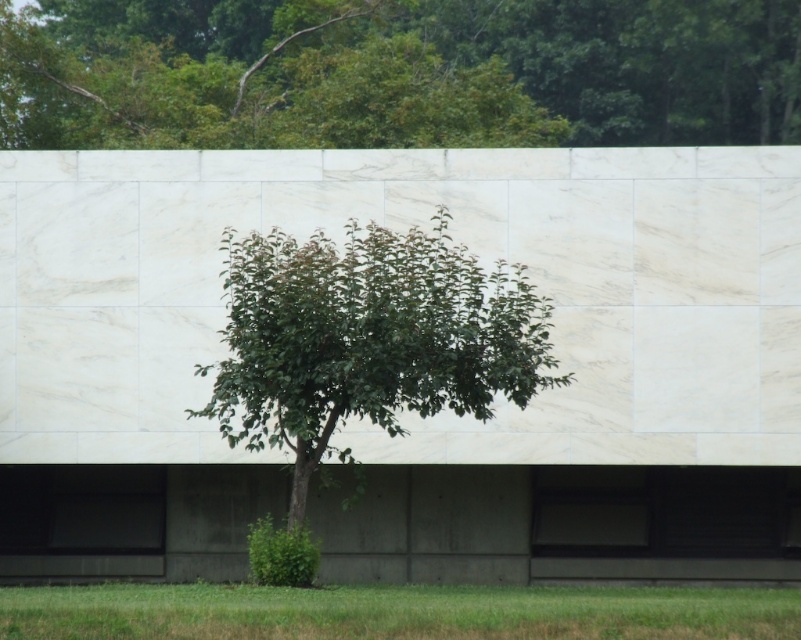
You are standing in front of the marble wall and want to place a small statue exactly halfway between the point at coordinate (437, 138) and the point at coordinate (194, 413). Will the statue be closer to the marble wall or the tree?

The statue placed halfway between point (437, 138) and point (194, 413) will be closer to the marble wall because point (437, 138) is closer to the camera than point (194, 413), making the midpoint nearer to the wall.

You are a gardener who wants to plant a new flower bed. You see the white marble wall at center and the green grass at lower center. Which surface can you plant flowers on?

The green grass at lower center is the suitable surface for planting flowers, as the white marble wall at center is positioned over it and likely not a suitable growing medium.